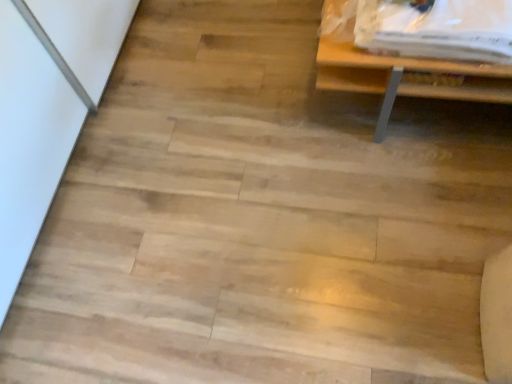
This screenshot has height=384, width=512. Find the location of `vacant space in front of wooden table at upper right`. vacant space in front of wooden table at upper right is located at coordinates (407, 225).